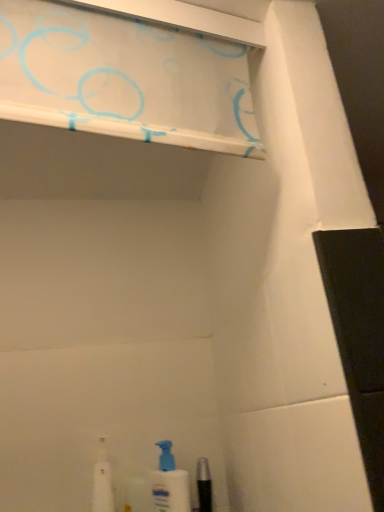
Question: Considering their positions, is white plastic spray bottle at lower center located in front of or behind white glossy shelf at upper center?

Choices:
 (A) front
 (B) behind

Answer: (B)

Question: From the image's perspective, is white plastic spray bottle at lower center positioned above or below white glossy shelf at upper center?

Choices:
 (A) above
 (B) below

Answer: (B)

Question: Which object is positioned closest to the white plastic spray bottle at lower center?

Choices:
 (A) white plastic bottle at lower left
 (B) white glossy shelf at upper center

Answer: (A)

Question: Which is farther from the white glossy shelf at upper center?

Choices:
 (A) white plastic bottle at lower left
 (B) white plastic spray bottle at lower center

Answer: (A)